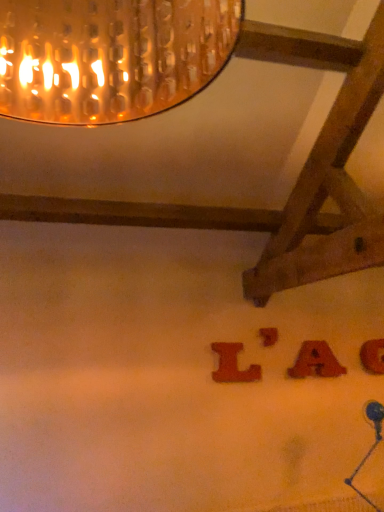
Question: Which direction should I rotate to face wooden letter at center, which appears as the 2th alphabet when viewed from the left, — up or down?

Choices:
 (A) up
 (B) down

Answer: (B)

Question: Can you confirm if matte wooden letter a at lower right, the 2th alphabet when ordered from right to left, is positioned to the left of wooden letter at lower right, the 1th alphabet from the right?

Choices:
 (A) no
 (B) yes

Answer: (B)

Question: Can you confirm if matte wooden letter a at lower right, the 2th alphabet when ordered from right to left, is wider than wooden letter at lower right, the 1th alphabet from the right?

Choices:
 (A) no
 (B) yes

Answer: (B)

Question: Does matte wooden letter a at lower right, the 2th alphabet when ordered from right to left, have a lesser height compared to wooden letter at lower right, the 1th alphabet from the right?

Choices:
 (A) yes
 (B) no

Answer: (A)

Question: Can you see matte wooden letter a at lower right, which is the third alphabet from left to right, touching wooden letter at lower right, the 4th alphabet when ordered from left to right?

Choices:
 (A) yes
 (B) no

Answer: (B)

Question: Is matte wooden letter a at lower right, which is the third alphabet from left to right, smaller than wooden letter at lower right, the 4th alphabet when ordered from left to right?

Choices:
 (A) yes
 (B) no

Answer: (B)

Question: Would you say wooden letter at lower right, the 1th alphabet from the right, is part of matte wooden letter a at lower right, which is the third alphabet from left to right,'s contents?

Choices:
 (A) no
 (B) yes

Answer: (A)

Question: Is wooden letter at lower right, the 1th alphabet from the right, not close to wooden letter at center, the 3th alphabet positioned from the right?

Choices:
 (A) yes
 (B) no

Answer: (B)

Question: Does wooden letter at lower right, the 4th alphabet when ordered from left to right, appear on the right side of wooden letter at center, the 3th alphabet positioned from the right?

Choices:
 (A) no
 (B) yes

Answer: (B)

Question: From a real-world perspective, is wooden letter at lower right, the 4th alphabet when ordered from left to right, on wooden letter at center, which appears as the 2th alphabet when viewed from the left?

Choices:
 (A) no
 (B) yes

Answer: (A)

Question: Considering the relative sizes of wooden letter at lower right, the 4th alphabet when ordered from left to right, and wooden letter at center, the 3th alphabet positioned from the right, in the image provided, is wooden letter at lower right, the 4th alphabet when ordered from left to right, shorter than wooden letter at center, the 3th alphabet positioned from the right,?

Choices:
 (A) no
 (B) yes

Answer: (A)

Question: Can you confirm if wooden letter at lower right, the 4th alphabet when ordered from left to right, is thinner than wooden letter at center, which appears as the 2th alphabet when viewed from the left?

Choices:
 (A) no
 (B) yes

Answer: (A)

Question: Does wooden letter at lower right, the 1th alphabet from the right, have a smaller size compared to wooden letter at center, the 3th alphabet positioned from the right?

Choices:
 (A) yes
 (B) no

Answer: (B)

Question: Does wooden letter at center, which appears as the 2th alphabet when viewed from the left, have a larger size compared to wooden letter l at center, the 4th alphabet in the right-to-left sequence?

Choices:
 (A) yes
 (B) no

Answer: (B)